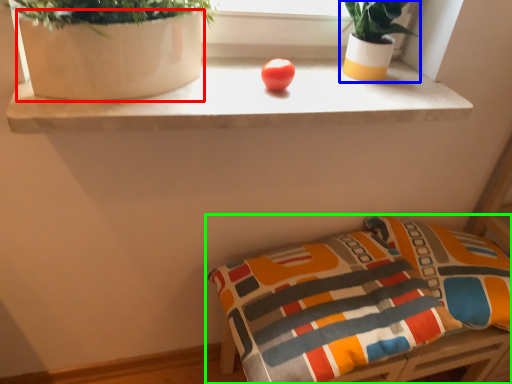
Question: Estimate the real-world distances between objects in this image. Which object is farther from vase (highlighted by a red box), houseplant (highlighted by a blue box) or furniture (highlighted by a green box)?

Choices:
 (A) houseplant
 (B) furniture

Answer: (B)